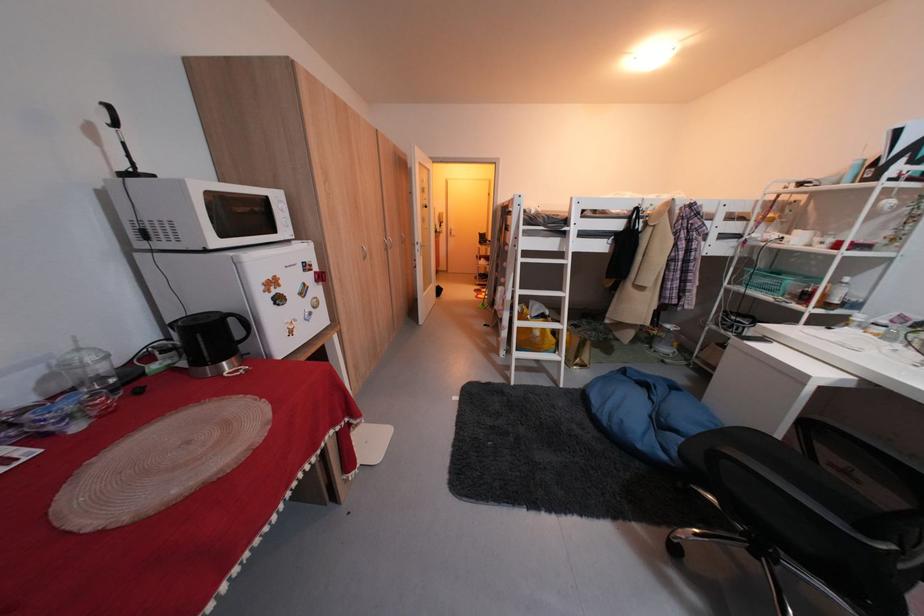
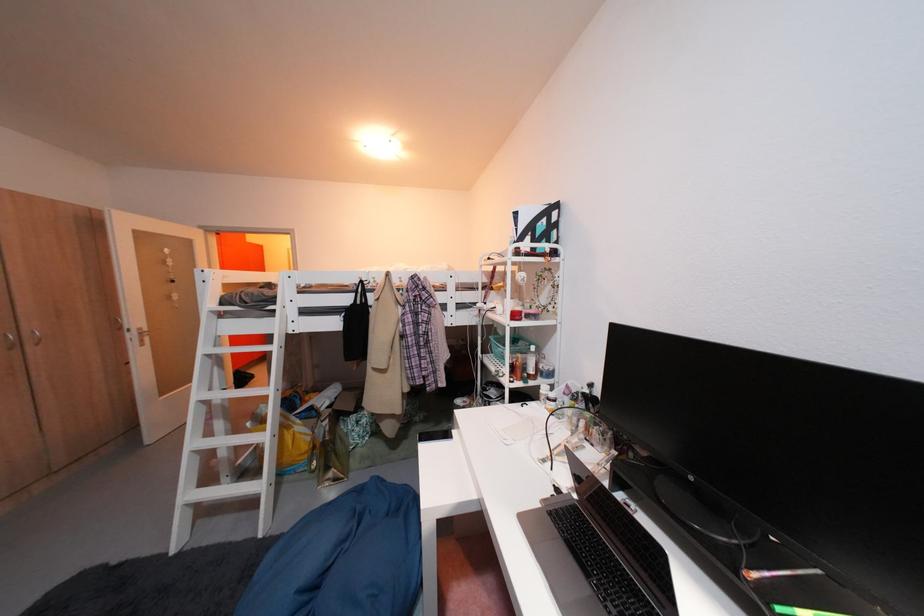
Where in the second image is the point corresponding to (623,238) from the first image?

(354, 314)